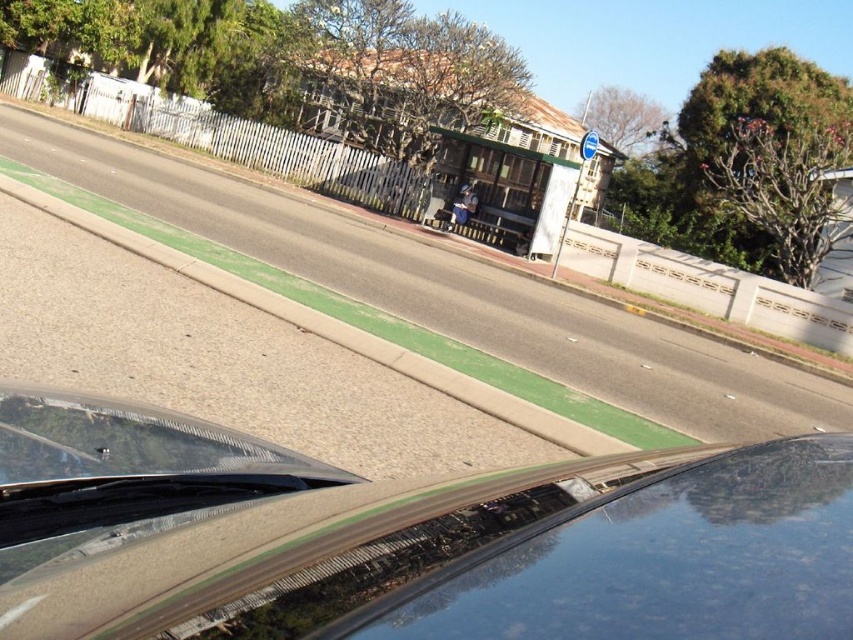
Question: Which point is closer to the camera?

Choices:
 (A) glossy black car at center
 (B) glossy black windshield at center

Answer: (B)

Question: Is glossy black car at center further to camera compared to glossy black windshield at center?

Choices:
 (A) yes
 (B) no

Answer: (A)

Question: Observing the image, what is the correct spatial positioning of glossy black car at center in reference to glossy black windshield at center?

Choices:
 (A) above
 (B) below

Answer: (B)

Question: Which of the following is the farthest from the observer?

Choices:
 (A) (511, 538)
 (B) (56, 604)

Answer: (B)

Question: Is glossy black car at center positioned at the back of glossy black windshield at center?

Choices:
 (A) no
 (B) yes

Answer: (B)